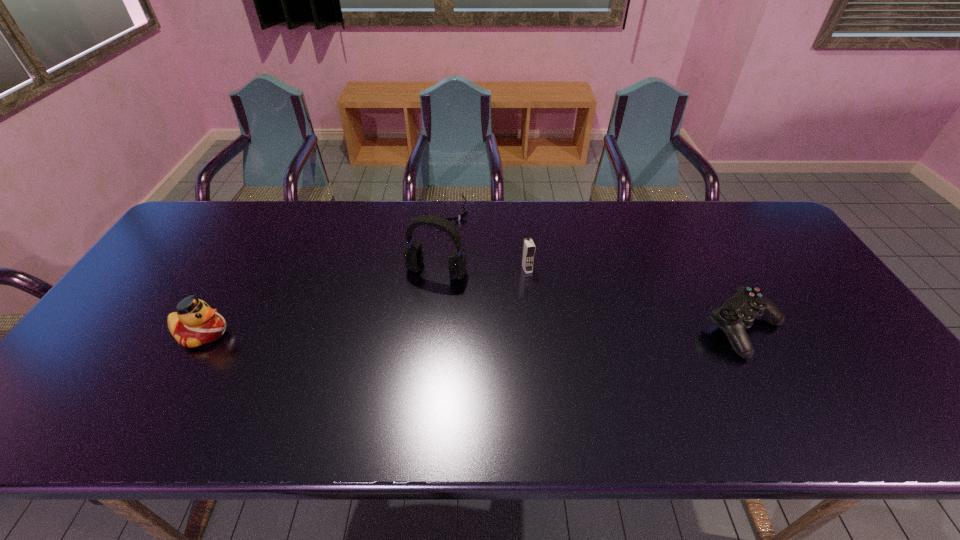
The image size is (960, 540). Find the location of `vacant space on the desktop that is between the duck and the rightmost object and is positioned on the front-facing side of the farthest object`. vacant space on the desktop that is between the duck and the rightmost object and is positioned on the front-facing side of the farthest object is located at coordinates (518, 331).

What are the coordinates of `free space on the desktop that is between the duck and the rightmost object and is positioned on the headband of the headset` in the screenshot? It's located at (406, 332).

Find the location of a particular element. Image resolution: width=960 pixels, height=540 pixels. free space on the desktop that is between the leftmost object and the second shortest object and is positioned on the front-facing side of the cellular telephone is located at coordinates (554, 330).